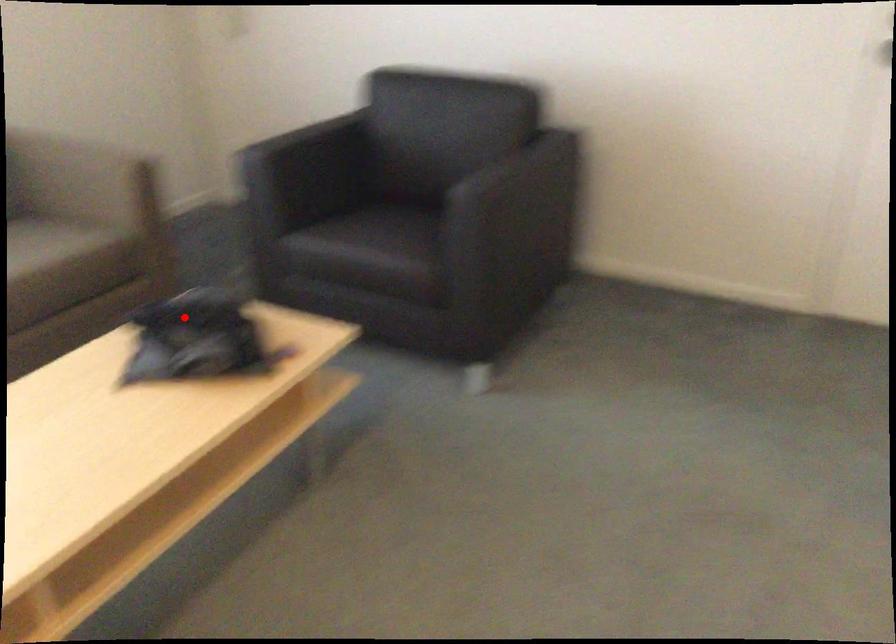
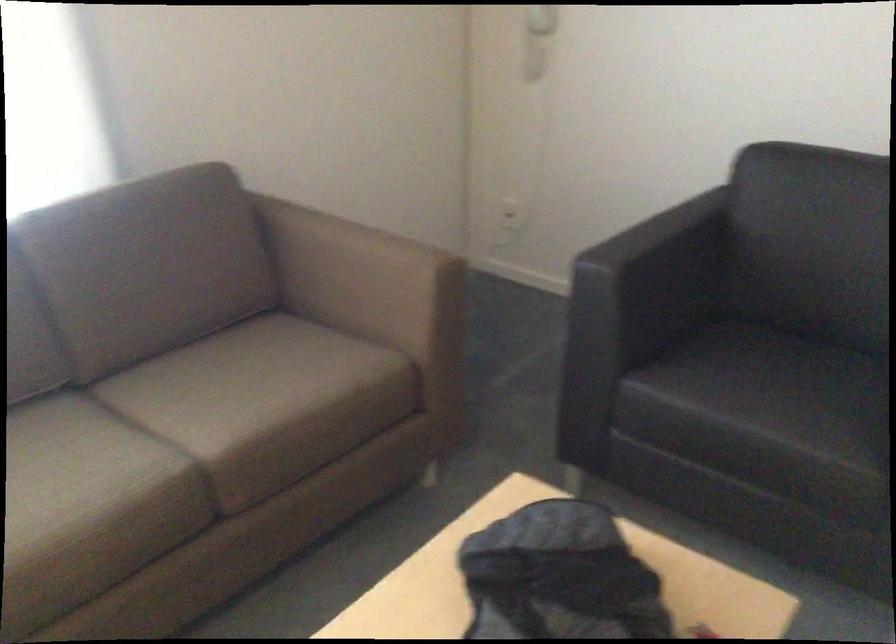
Question: I am providing you with two images of the same scene from different viewpoints. Given a red point in image1, look at the same physical point in image2. Is it:

Choices:
 (A) Closer to the viewpoint
 (B) Farther from the viewpoint

Answer: (A)